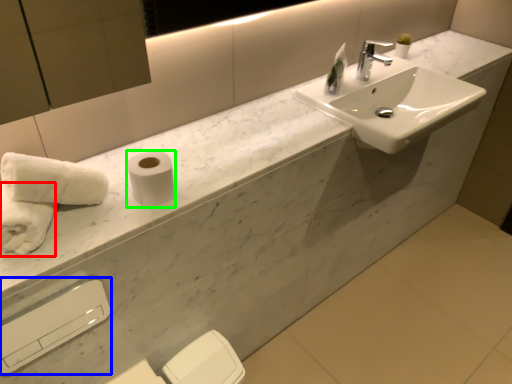
Question: Based on their relative distances, which object is farther from bath towel (highlighted by a red box)? Choose from hand dryer (highlighted by a blue box) and toilet paper (highlighted by a green box).

Choices:
 (A) hand dryer
 (B) toilet paper

Answer: (A)